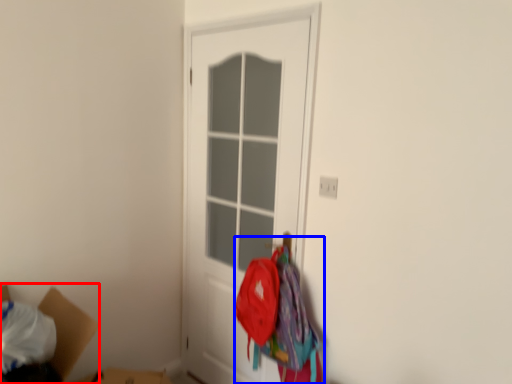
Question: Which object appears farthest to the camera in this image, cardboard box (highlighted by a red box) or laundry (highlighted by a blue box)?

Choices:
 (A) cardboard box
 (B) laundry

Answer: (B)